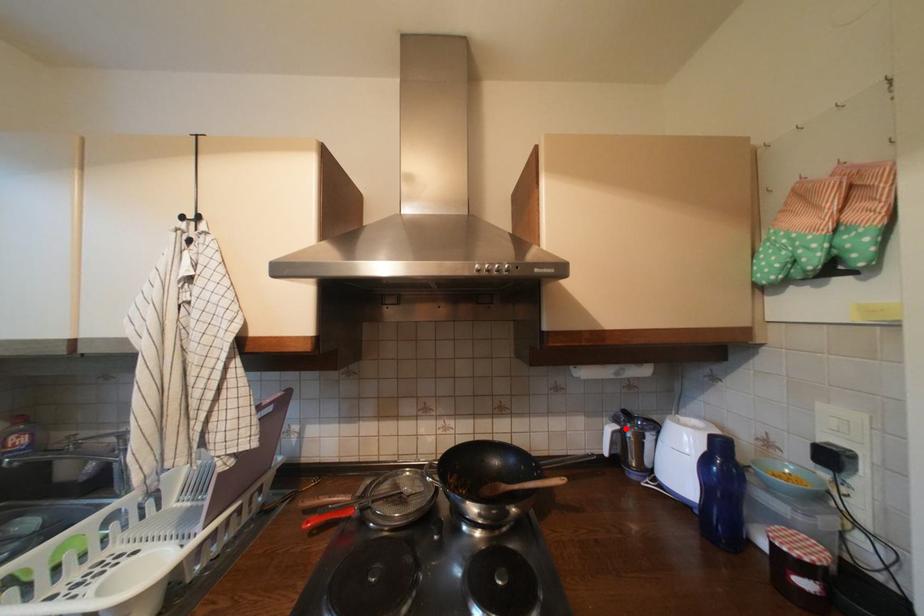
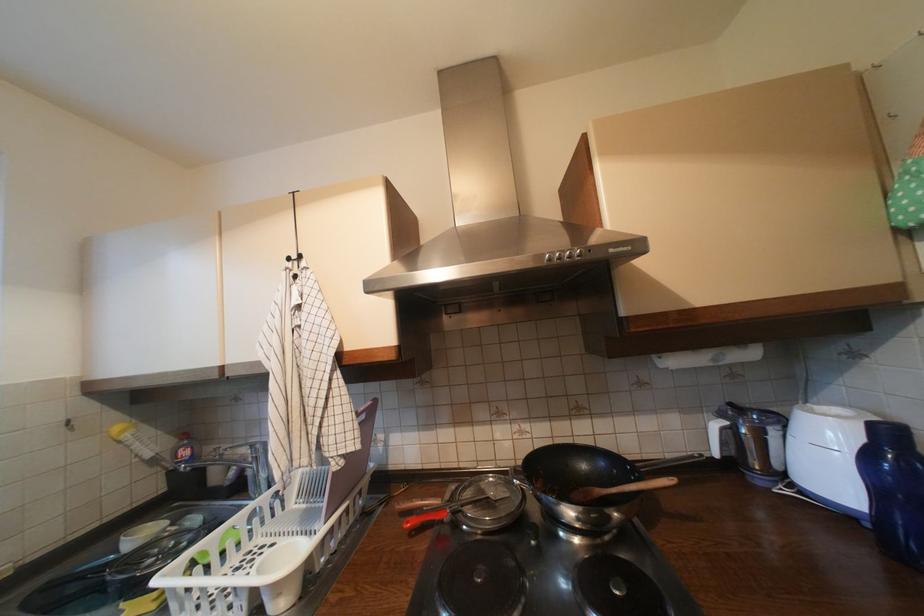
Where in the second image is the point corresponding to the highlighted location from the first image?

(735, 424)